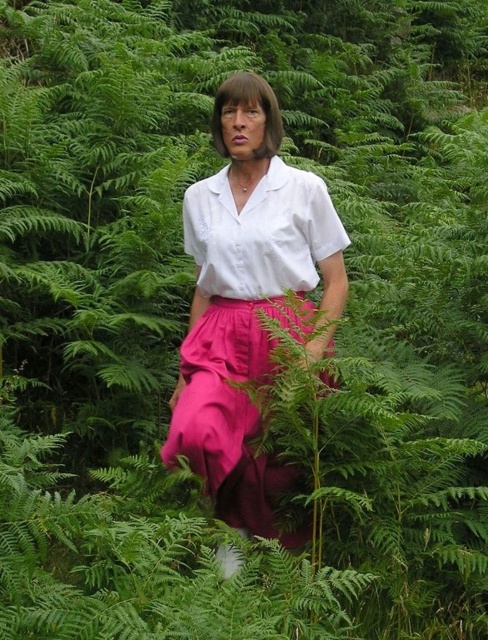
Who is positioned more to the left, matte pink skirt at center or white cotton shirt at center?

white cotton shirt at center is more to the left.

Does matte pink skirt at center appear under white cotton shirt at center?

Indeed, matte pink skirt at center is positioned under white cotton shirt at center.

Where is `matte pink skirt at center`? The image size is (488, 640). matte pink skirt at center is located at coordinates (245, 296).

Who is shorter, matte pink skirt at center or matte pink fabric skirt at center?

matte pink fabric skirt at center

Between matte pink skirt at center and matte pink fabric skirt at center, which one appears on the right side from the viewer's perspective?

matte pink skirt at center

What do you see at coordinates (245, 296) in the screenshot? I see `matte pink skirt at center` at bounding box center [245, 296].

Identify the location of matte pink skirt at center. This screenshot has height=640, width=488. (245, 296).

Can you confirm if matte pink fabric skirt at center is thinner than white cotton shirt at center?

Indeed, matte pink fabric skirt at center has a lesser width compared to white cotton shirt at center.

Between matte pink fabric skirt at center and white cotton shirt at center, which one has less height?

white cotton shirt at center is shorter.

Which is in front, point (203, 314) or point (235, 257)?

Point (235, 257)

The image size is (488, 640). Find the location of `matte pink fabric skirt at center`. matte pink fabric skirt at center is located at coordinates (231, 413).